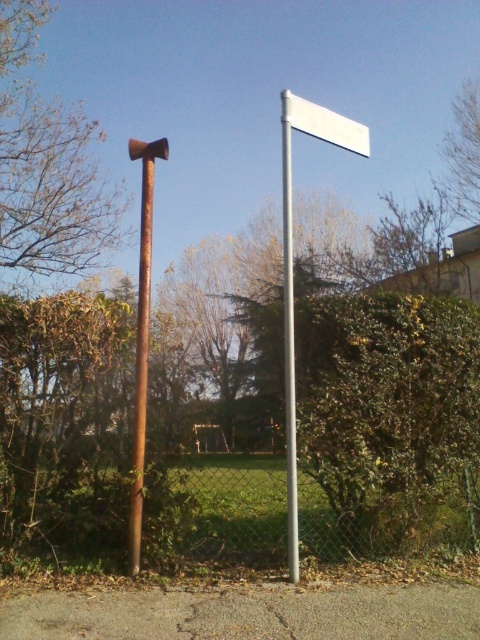
Question: Which point is farther from the camera taking this photo?

Choices:
 (A) (288, 477)
 (B) (149, 156)
 (C) (342, 141)

Answer: (C)

Question: Where is rusty metal pole at left located in relation to white plastic sign at upper center in the image?

Choices:
 (A) right
 (B) left

Answer: (B)

Question: Can you confirm if rusty metal pole at left is thinner than silver metallic signpost at center?

Choices:
 (A) no
 (B) yes

Answer: (A)

Question: Which point is farther from the camera taking this photo?

Choices:
 (A) (295, 433)
 (B) (344, 132)
 (C) (135, 451)

Answer: (B)

Question: Is silver metallic signpost at center positioned in front of white plastic sign at upper center?

Choices:
 (A) yes
 (B) no

Answer: (A)

Question: Which object is farther from the camera taking this photo?

Choices:
 (A) white plastic sign at upper center
 (B) silver metallic signpost at center

Answer: (A)